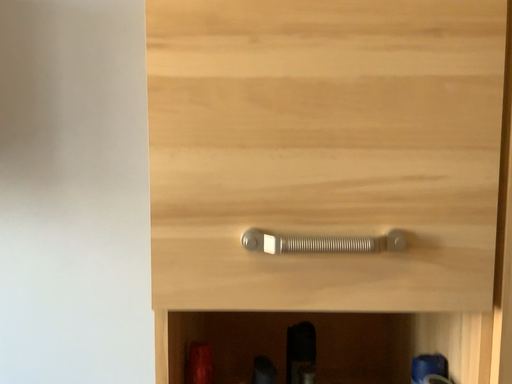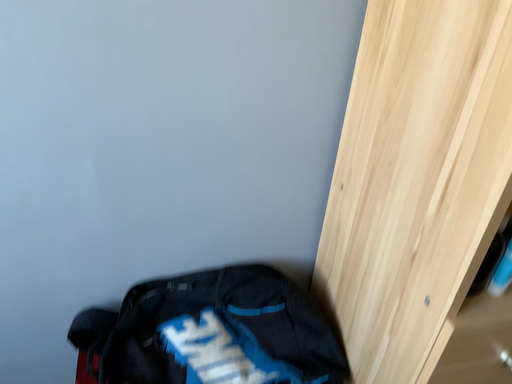
Question: How did the camera likely rotate when shooting the video?

Choices:
 (A) rotated downward
 (B) rotated upward

Answer: (A)